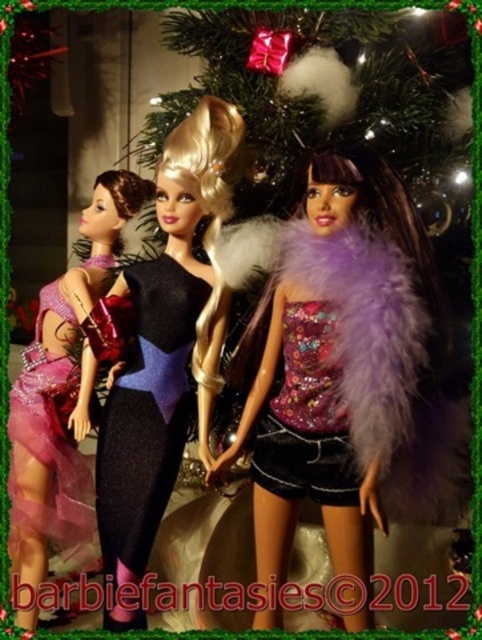
Question: Does green textured christmas tree at center appear on the right side of black sequined dress at center?

Choices:
 (A) yes
 (B) no

Answer: (A)

Question: Which point is farther to the camera?

Choices:
 (A) (414, 225)
 (B) (173, 316)
 (C) (121, 492)

Answer: (B)

Question: Among these points, which one is nearest to the camera?

Choices:
 (A) (327, 480)
 (B) (175, 269)

Answer: (A)

Question: Is black sequined dress at center to the right of black textured dress at center from the viewer's perspective?

Choices:
 (A) no
 (B) yes

Answer: (B)

Question: Which of the following is the farthest from the observer?

Choices:
 (A) matte pink tulle dress at left
 (B) purple sequined top at center
 (C) black textured dress at center
 (D) green textured christmas tree at center

Answer: (A)

Question: Where is black sequined dress at center located in relation to black textured dress at center in the image?

Choices:
 (A) right
 (B) left

Answer: (A)